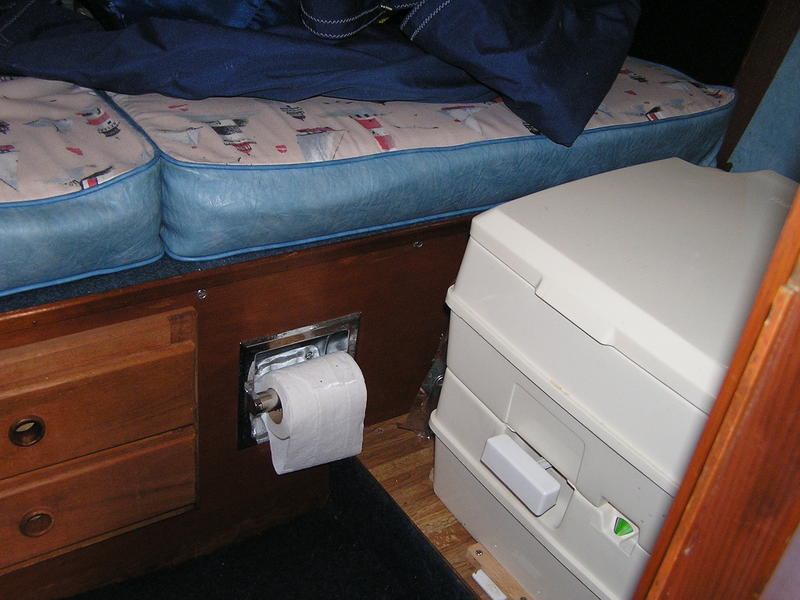
Identify the location of bedsheet. This screenshot has height=600, width=800. (214, 65).